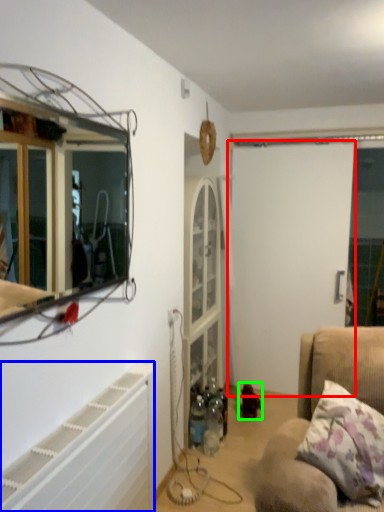
Question: Which is nearer to the screen door (highlighted by a red box)? radiator (highlighted by a blue box) or toy (highlighted by a green box).

Choices:
 (A) radiator
 (B) toy

Answer: (B)